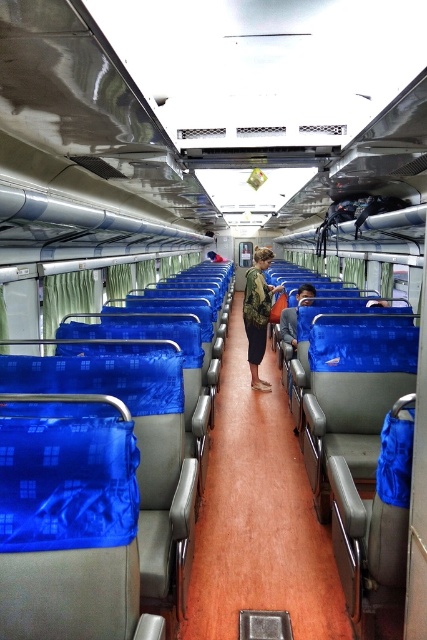
You are a passenger sitting in the train carriage and want to take a photo of two points marked in the scene. The first point is at coordinates point (256, 312) and the second is at point (295, 324). Which point will appear larger in your photo?

Point (256, 312) is closer to the camera than point (295, 324), so it will appear larger in the photo.

You are a passenger sitting in the train carriage and want to place your blue fabric bag at center on the brown wood floor at center. Can you reach the floor from your seat?

The brown wood floor at center is closer to the viewer than the blue fabric bag at center, which means the floor is within reach from your seat. You can place the bag on the floor.